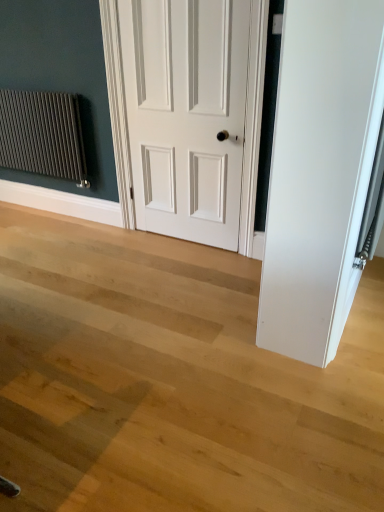
Where is `matte dark gray radiator at left`? matte dark gray radiator at left is located at coordinates (42, 135).

Measure the distance between point (6, 101) and camera.

They are 10.52 feet apart.

Describe the element at coordinates (42, 135) in the screenshot. I see `matte dark gray radiator at left` at that location.

Image resolution: width=384 pixels, height=512 pixels. Describe the element at coordinates (192, 115) in the screenshot. I see `white matte door at center` at that location.

The image size is (384, 512). What are the coordinates of `white matte door at center` in the screenshot? It's located at (192, 115).

The width and height of the screenshot is (384, 512). I want to click on matte dark gray radiator at left, so click(x=42, y=135).

Based on their positions, is matte dark gray radiator at left located to the left or right of white matte door at center?

From the image, it's evident that matte dark gray radiator at left is to the left of white matte door at center.

Who is more distant, matte dark gray radiator at left or white matte door at center?

matte dark gray radiator at left is further away from the camera.

Which is farther from the camera, (37, 119) or (119, 27)?

The point (37, 119) is more distant.

From the image's perspective, which one is positioned higher, matte dark gray radiator at left or white matte door at center?

matte dark gray radiator at left.

From a real-world perspective, is matte dark gray radiator at left positioned under white matte door at center based on gravity?

Indeed, from a real-world perspective, matte dark gray radiator at left is positioned beneath white matte door at center.

Is matte dark gray radiator at left thinner than white matte door at center?

No.

Does matte dark gray radiator at left have a lesser height compared to white matte door at center?

Yes, matte dark gray radiator at left is shorter than white matte door at center.

Considering the sizes of matte dark gray radiator at left and white matte door at center in the image, is matte dark gray radiator at left bigger or smaller than white matte door at center?

Considering their sizes, matte dark gray radiator at left takes up less space than white matte door at center.

Would you say matte dark gray radiator at left is outside white matte door at center?

matte dark gray radiator at left is positioned outside white matte door at center.

Is matte dark gray radiator at left in contact with white matte door at center?

No, matte dark gray radiator at left is not touching white matte door at center.

Is white matte door at center at the back of matte dark gray radiator at left?

No, matte dark gray radiator at left is not facing away from white matte door at center.

Find the location of a particular element. radiator below the white matte door at center (from a real-world perspective) is located at coordinates (42, 135).

Which object is positioned more to the left, white matte door at center or matte dark gray radiator at left?

From the viewer's perspective, matte dark gray radiator at left appears more on the left side.

Which is in front, white matte door at center or matte dark gray radiator at left?

white matte door at center is in front.

Is point (205, 214) in front of point (69, 151)?

Yes, point (205, 214) is closer to viewer.

From the image's perspective, is white matte door at center above or below matte dark gray radiator at left?

Clearly, from the image's perspective, white matte door at center is below matte dark gray radiator at left.

In the scene shown: From a real-world perspective, is white matte door at center physically below matte dark gray radiator at left?

No, from a real-world perspective, white matte door at center is not beneath matte dark gray radiator at left.

Between white matte door at center and matte dark gray radiator at left, which one has larger width?

Wider between the two is matte dark gray radiator at left.

In the scene shown: Can you confirm if white matte door at center is shorter than matte dark gray radiator at left?

No.

Who is bigger, white matte door at center or matte dark gray radiator at left?

white matte door at center is bigger.

Is white matte door at center surrounding matte dark gray radiator at left?

No, matte dark gray radiator at left is not inside white matte door at center.

Is white matte door at center not near matte dark gray radiator at left?

white matte door at center is near matte dark gray radiator at left, not far away.

Looking at this image, does white matte door at center turn towards matte dark gray radiator at left?

No, white matte door at center does not turn towards matte dark gray radiator at left.

Can you tell me how much white matte door at center and matte dark gray radiator at left differ in facing direction?

white matte door at center and matte dark gray radiator at left are facing 0.254 degrees away from each other.

Where is `radiator located behind the white matte door at center`? This screenshot has height=512, width=384. radiator located behind the white matte door at center is located at coordinates (42, 135).

This screenshot has height=512, width=384. In order to click on radiator located above the white matte door at center (from the image's perspective) in this screenshot , I will do `click(42, 135)`.

Locate an element on the screen. door that is in front of the matte dark gray radiator at left is located at coordinates (192, 115).